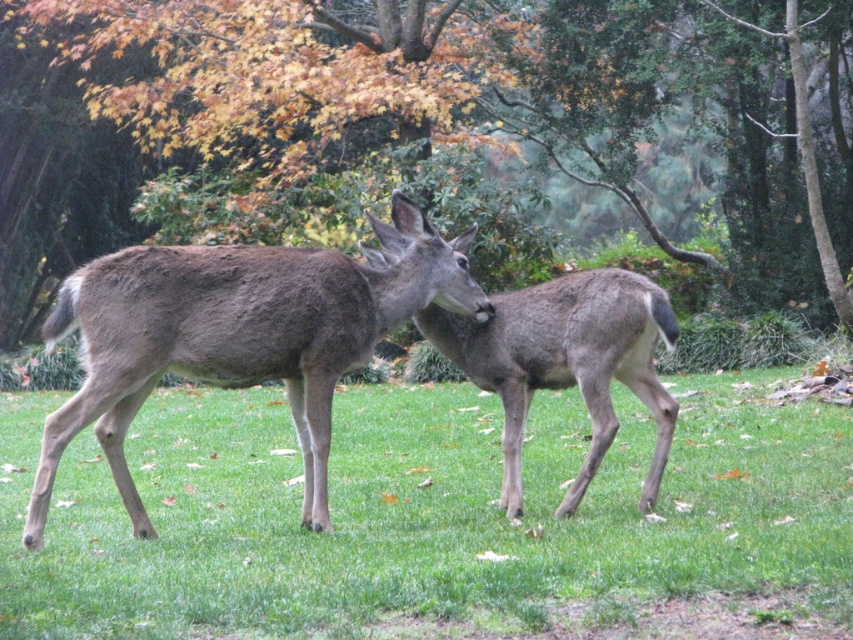
You are a wildlife photographer aiming to capture a close shot of the brown fuzzy roe deer at center. Your camera has a maximum zoom range of 5 meters. Can you get a clear close shot without moving closer?

The brown fuzzy roe deer at center is 5.86 meters away from the viewer. Since the camera can only zoom up to 5 meters, you cannot get a clear close shot without moving closer.

You are a wildlife researcher observing two deer in a park. You notice a specific point marked at coordinates (236, 337). Which deer does this point correspond to?

The point at (236, 337) is located on the brown fuzzy roe deer at center.